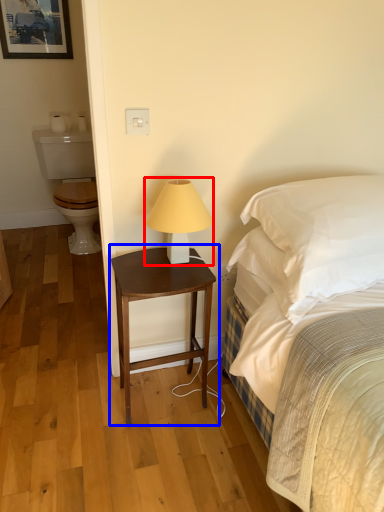
Question: Which object appears farthest to the camera in this image, table lamp (highlighted by a red box) or nightstand (highlighted by a blue box)?

Choices:
 (A) table lamp
 (B) nightstand

Answer: (B)